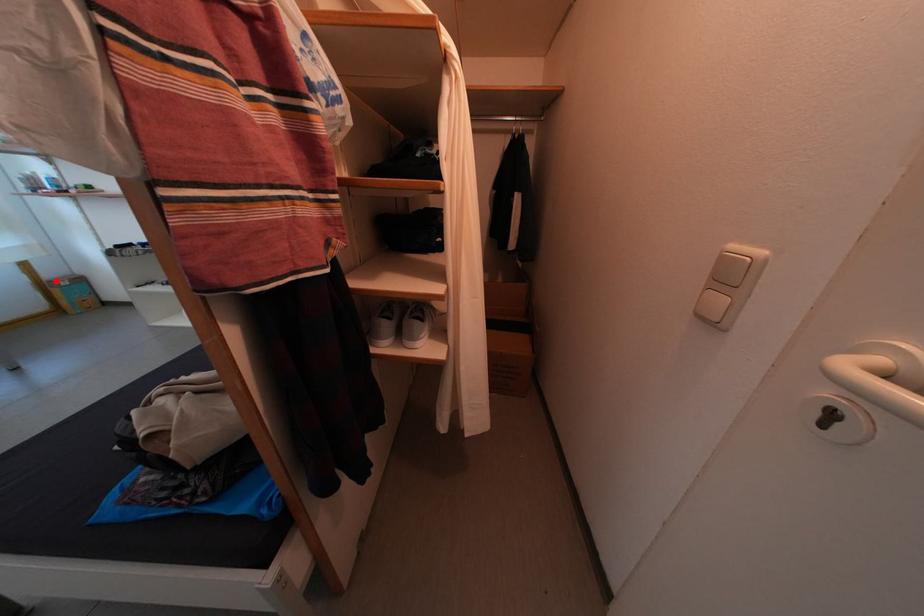
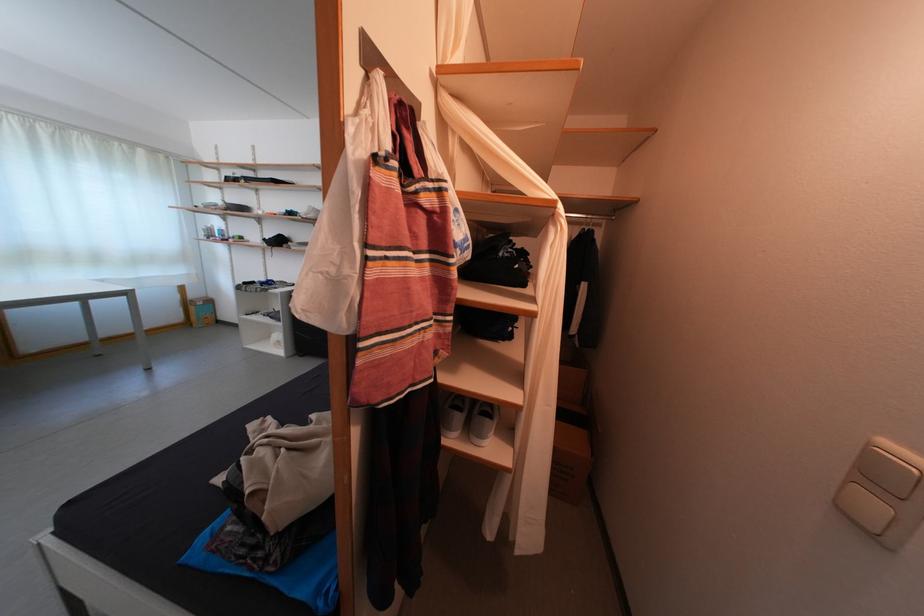
Question: I am providing you with two images of the same scene from different viewpoints. A red point is shown in image1. For the corresponding object point in image2, is it positioned nearer or farther from the camera?

Choices:
 (A) Nearer
 (B) Farther

Answer: (A)